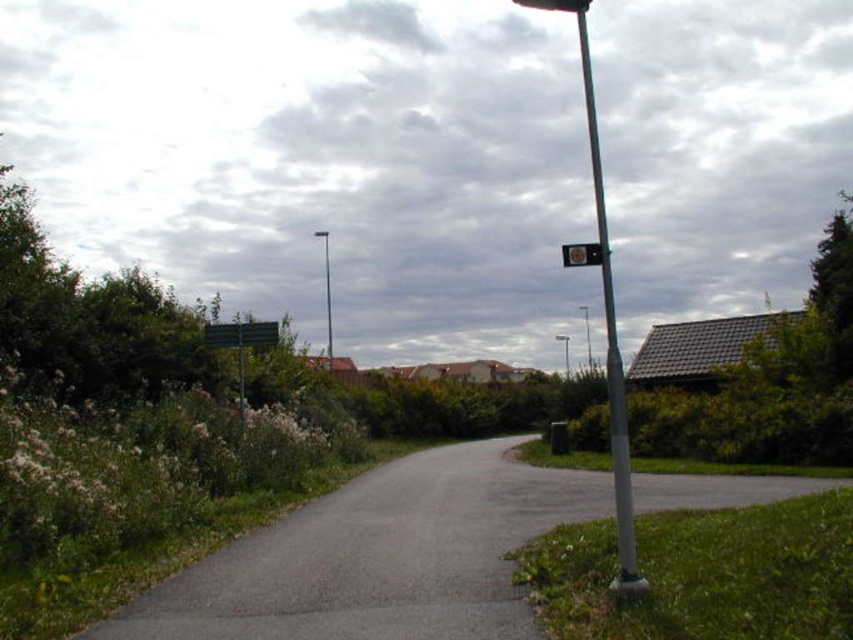
You are a pedestrian standing on the asphalt road at center and want to reach the metallic pole at right. Which direction should you move to get there?

The metallic pole at right is located above the asphalt road at center, so you should move upwards to reach it.

You are standing at the origin point of the coordinate system in this suburban scene. The origin is at the bottom left corner of the image. You need to locate the metallic pole at center. What are its coordinates?

The metallic pole at center is located at coordinates point (328, 294).

You are a delivery person trying to locate the address on the street. You see the metallic pole at center and the metallic rectangular sign at upper center. Which object is closer to the left side of the path?

The metallic pole at center is positioned on the left side of the metallic rectangular sign at upper center, so it is closer to the left side of the path.